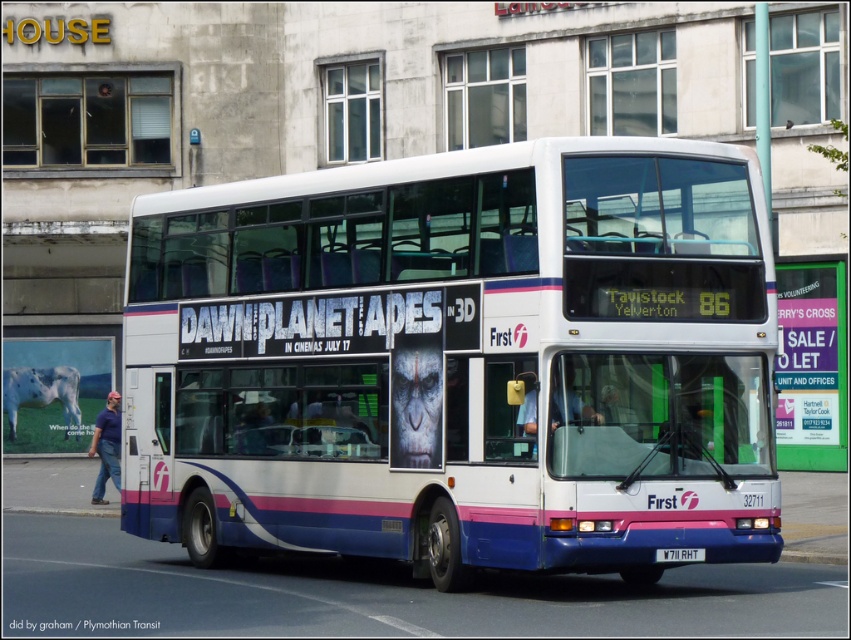
Question: Which point is farther to the camera?

Choices:
 (A) (455, 561)
 (B) (672, 557)

Answer: (A)

Question: Does white matte/deck bus at center have a greater width compared to white plastic license plate at center?

Choices:
 (A) yes
 (B) no

Answer: (A)

Question: Which point is closer to the camera?

Choices:
 (A) white matte/deck bus at center
 (B) white plastic license plate at center

Answer: (A)

Question: Does white matte/deck bus at center appear over white plastic license plate at center?

Choices:
 (A) yes
 (B) no

Answer: (A)

Question: Which object is closer to the camera taking this photo?

Choices:
 (A) white matte/deck bus at center
 (B) white plastic license plate at center

Answer: (A)

Question: Is white matte/deck bus at center wider than white plastic license plate at center?

Choices:
 (A) no
 (B) yes

Answer: (B)